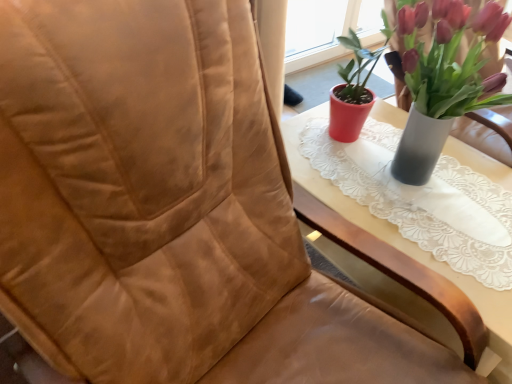
Where is `free space in front of matte red pot at upper right`? The width and height of the screenshot is (512, 384). free space in front of matte red pot at upper right is located at coordinates (446, 243).